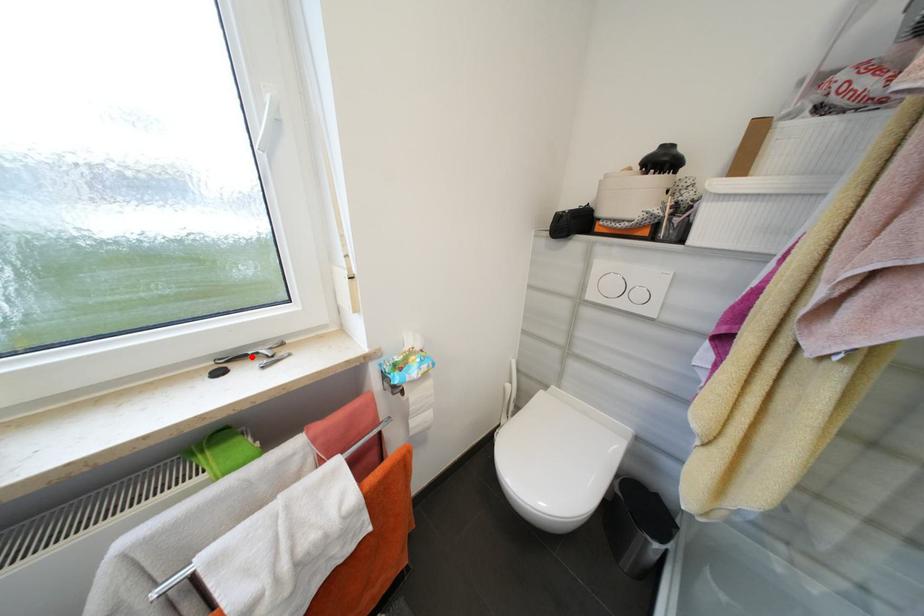
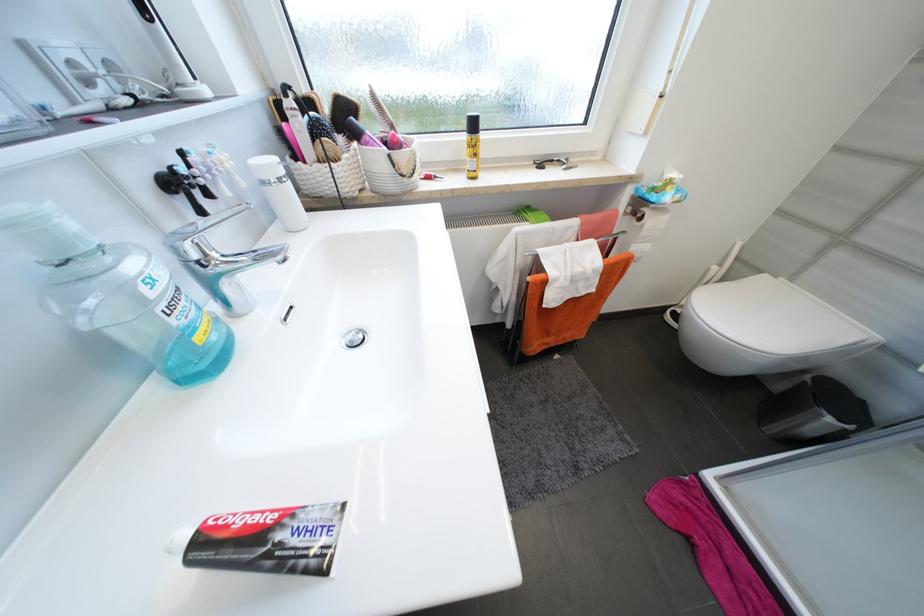
The point at the highlighted location is marked in the first image. Where is the corresponding point in the second image?

(558, 161)